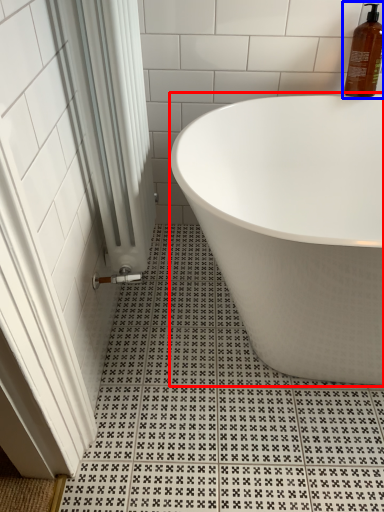
Question: Which point is further to the camera, bathtub (highlighted by a red box) or cleaning product (highlighted by a blue box)?

Choices:
 (A) bathtub
 (B) cleaning product

Answer: (B)